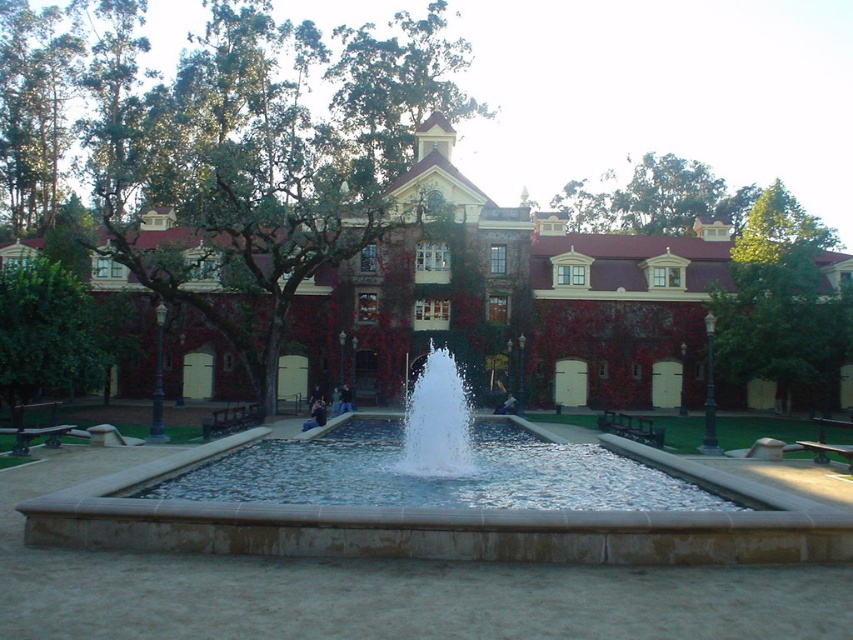
Who is lower down, green leafy tree at center or white water at center?

white water at center is below.

Is point (171, 262) more distant than point (456, 369)?

Yes, point (171, 262) is behind point (456, 369).

You are a GUI agent. You are given a task and a screenshot of the screen. Output one action in this format:
    pyautogui.click(x=<x>, y=<y>)
    Task: Click on the green leafy tree at center
    This screenshot has width=853, height=640.
    Given the screenshot: What is the action you would take?
    pyautogui.click(x=259, y=150)

Does green leafy tree at upper right appear under white water at center?

No.

Does green leafy tree at upper right have a larger size compared to white water at center?

Correct, green leafy tree at upper right is larger in size than white water at center.

Locate an element on the screen. The image size is (853, 640). green leafy tree at upper right is located at coordinates (782, 301).

Is green leafy tree at center closer to camera compared to green leafy tree at upper right?

Yes, green leafy tree at center is in front of green leafy tree at upper right.

Does green leafy tree at center lie behind green leafy tree at upper right?

No, green leafy tree at center is in front of green leafy tree at upper right.

In order to click on green leafy tree at center in this screenshot , I will do `click(259, 150)`.